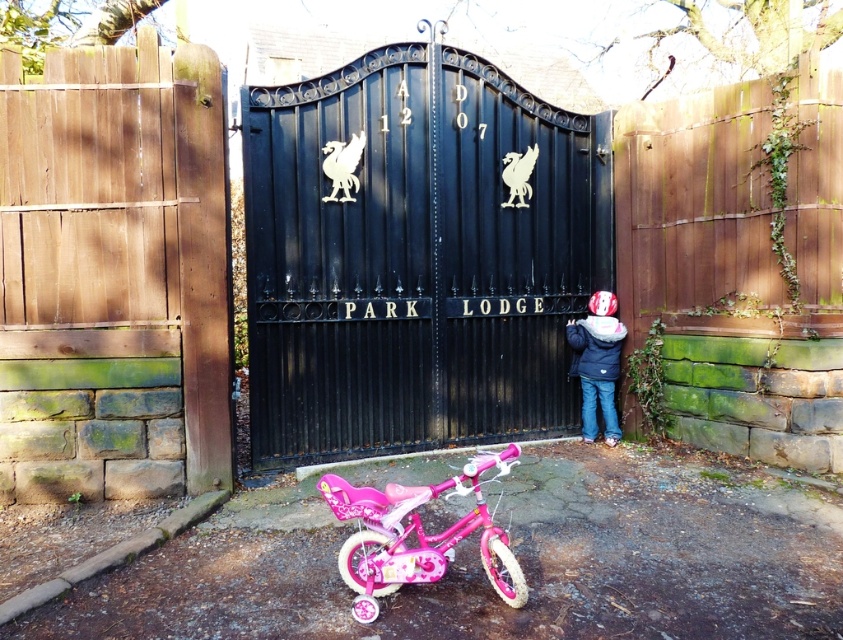
You are standing in front of the scene described. You need to locate the black metal gate at center. Based on the coordinates provided, can you determine its position relative to the wooden fence on the left?

The black metal gate at center is located at coordinates point (416,257), which places it centrally in the scene. Since the wooden fence is on the left, the gate is positioned to the right of the fence.

You are a delivery person standing in front of the black metal gate at center and the matte blue jacket at center. Which object is bigger?

The black metal gate at center has a larger size compared to the matte blue jacket at center, so the black metal gate at center is bigger.